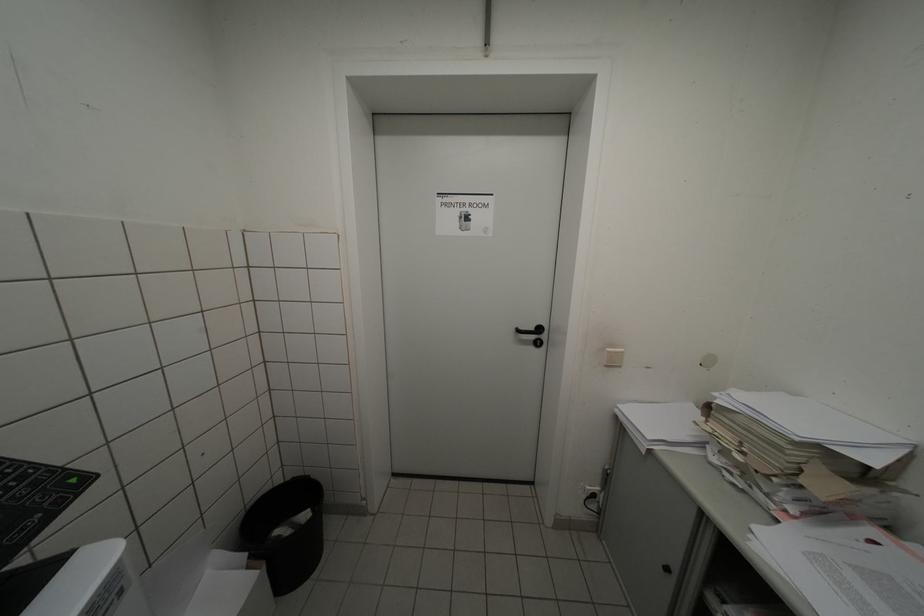
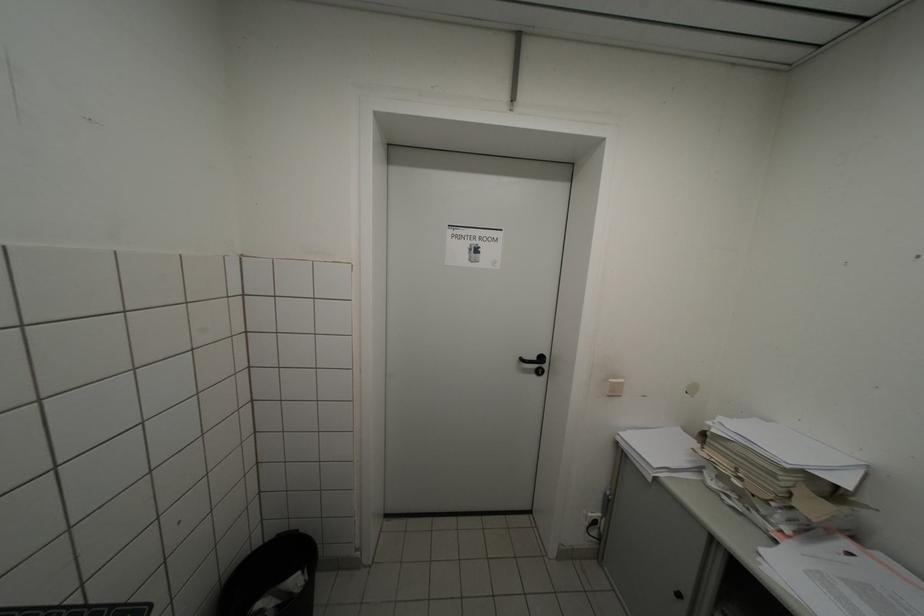
In the second image, find the point that corresponds to [615,352] in the first image.

(618, 383)